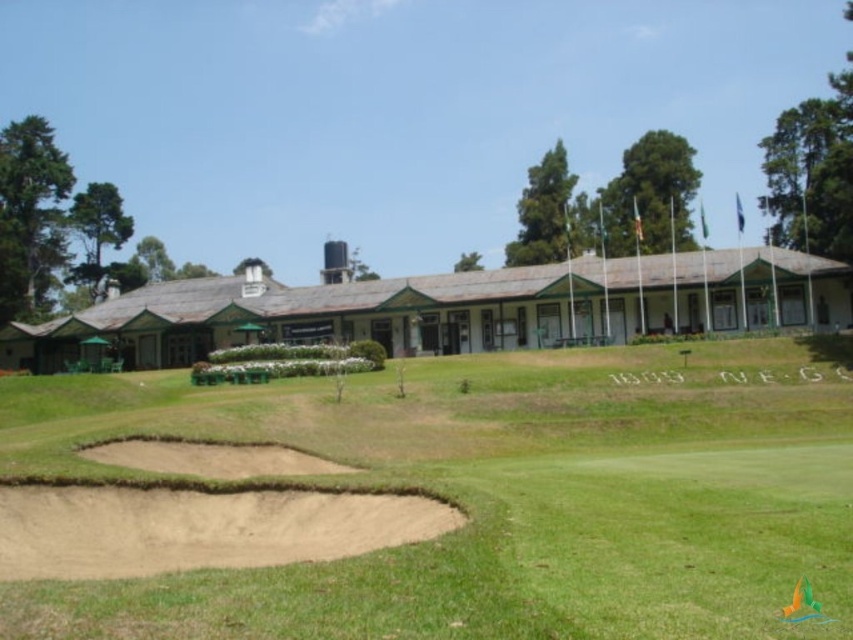
You are a golfer preparing to hit a ball from the green grassy golf course at center towards the flag located near the brown sand bunker at center. Considering the height difference between the two areas, which direction should you aim to ensure the ball rolls towards the bunker?

The green grassy golf course at center is shorter than the brown sand bunker at center, so you should aim towards the bunker as the ball will naturally roll downhill from the higher grassy area to the lower sand bunker.

You are standing at the origin point of the image. Which direction should you walk to reach the green grassy golf course at center?

The green grassy golf course at center is located at point 0.777 on the x axis and 0.583 on the y axis. Since the origin is at the bottom left corner of the image, you should walk northeast to reach it.